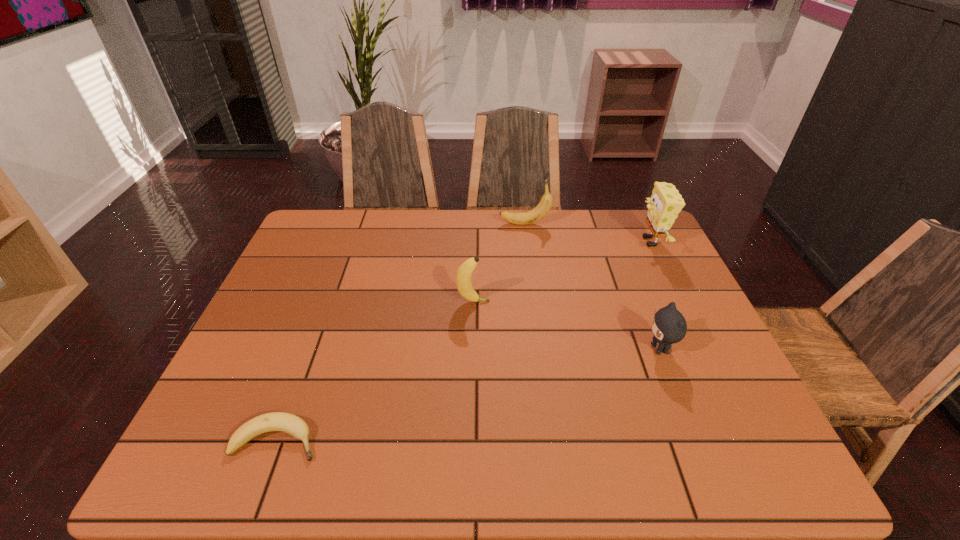
Locate an element on the screen. sponge that is at the far edge is located at coordinates (665, 203).

The image size is (960, 540). Identify the location of banana at the far edge. (525, 218).

Where is `object that is at the near edge`? The width and height of the screenshot is (960, 540). object that is at the near edge is located at coordinates (276, 421).

The height and width of the screenshot is (540, 960). I want to click on object that is at the left edge, so click(276, 421).

The width and height of the screenshot is (960, 540). In order to click on sponge that is positioned at the right edge in this screenshot , I will do `click(665, 203)`.

You are a GUI agent. You are given a task and a screenshot of the screen. Output one action in this format:
    pyautogui.click(x=<x>, y=<y>)
    Task: Click on the kitten situated at the right edge
    The width and height of the screenshot is (960, 540).
    Given the screenshot: What is the action you would take?
    pyautogui.click(x=669, y=326)

Locate an element on the screen. object present at the near left corner is located at coordinates (276, 421).

Where is `object that is positioned at the far right corner`? The image size is (960, 540). object that is positioned at the far right corner is located at coordinates [665, 203].

At what (x,y) coordinates should I click in order to perform the action: click on blank area at the far edge. Please return your answer as a coordinate pair (x, y). Image resolution: width=960 pixels, height=540 pixels. Looking at the image, I should click on (369, 233).

Locate an element on the screen. free location at the near edge is located at coordinates (314, 436).